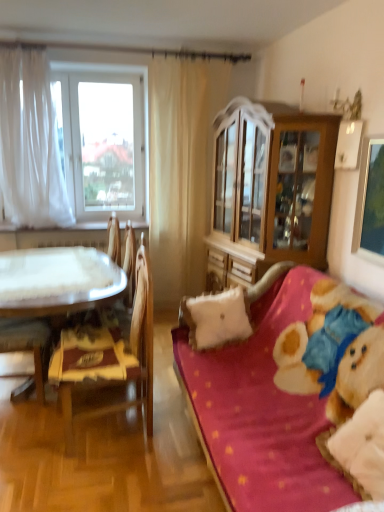
The height and width of the screenshot is (512, 384). Find the location of `free area below wooden chair at left (from a real-world perspective)`. free area below wooden chair at left (from a real-world perspective) is located at coordinates (105, 428).